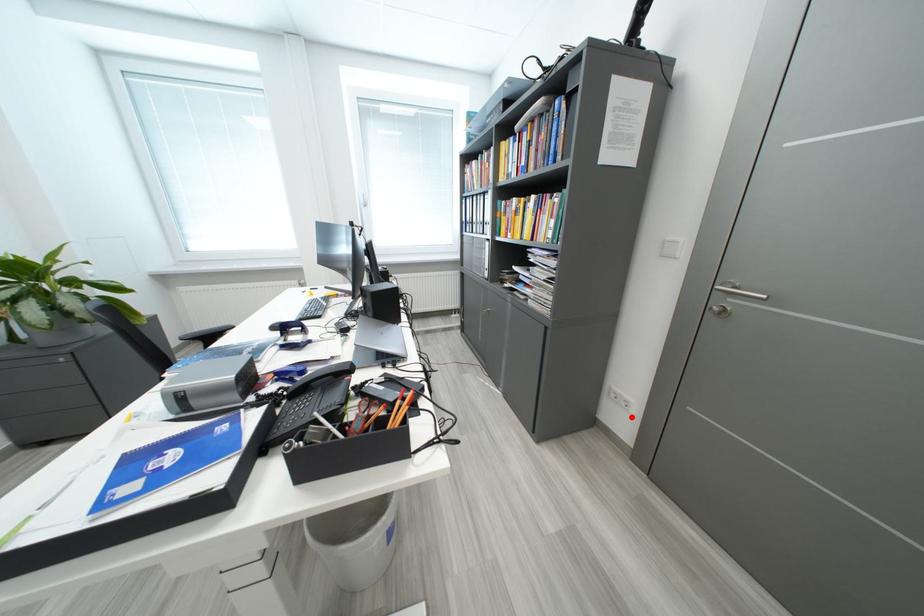
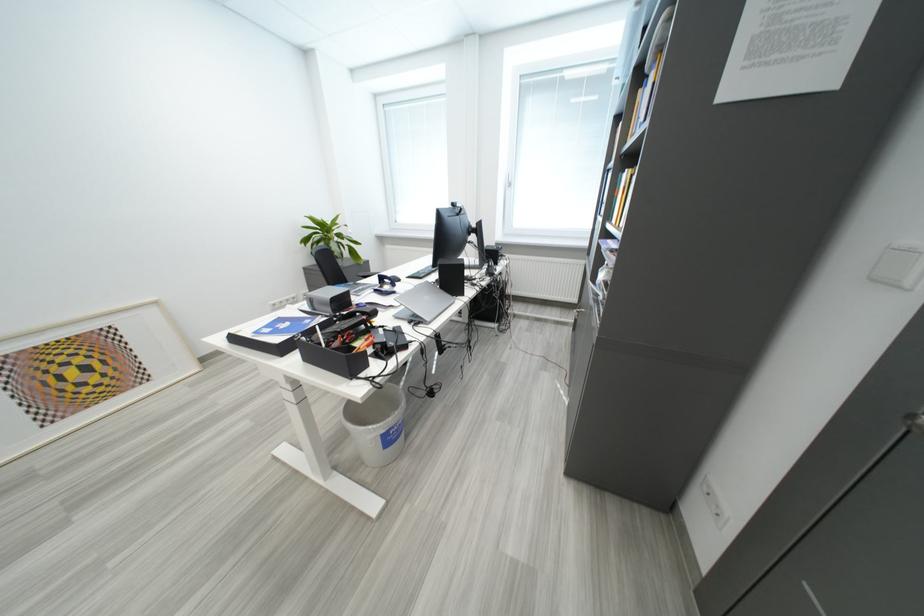
Where in the second image is the point corresponding to the highlighted location from the first image?

(718, 525)